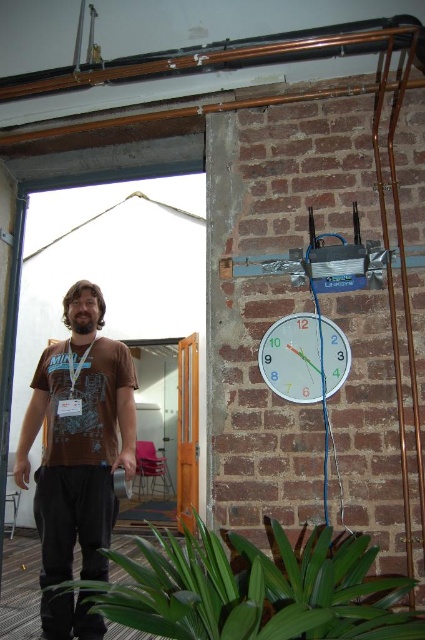
Is green leafy plant at lower center taller than white plastic clock at upper right?

Yes, green leafy plant at lower center is taller than white plastic clock at upper right.

Where is `green leafy plant at lower center`? green leafy plant at lower center is located at coordinates (255, 589).

Where is `green leafy plant at lower center`? green leafy plant at lower center is located at coordinates (255, 589).

Is brown cotton t-shirt at left below white plastic clock at upper right?

Indeed, brown cotton t-shirt at left is positioned under white plastic clock at upper right.

Which is more to the left, brown cotton t-shirt at left or white plastic clock at upper right?

Positioned to the left is brown cotton t-shirt at left.

The image size is (425, 640). What do you see at coordinates (79, 438) in the screenshot?
I see `brown cotton t-shirt at left` at bounding box center [79, 438].

This screenshot has height=640, width=425. What are the coordinates of `brown cotton t-shirt at left` in the screenshot? It's located at (79, 438).

Consider the image. Is green leafy plant at lower center to the left of brown cotton t-shirt at left from the viewer's perspective?

In fact, green leafy plant at lower center is to the right of brown cotton t-shirt at left.

Is green leafy plant at lower center wider than brown cotton t-shirt at left?

Yes.

Who is more forward, (x=311, y=602) or (x=82, y=540)?

Point (x=311, y=602) is more forward.

The height and width of the screenshot is (640, 425). I want to click on green leafy plant at lower center, so click(x=255, y=589).